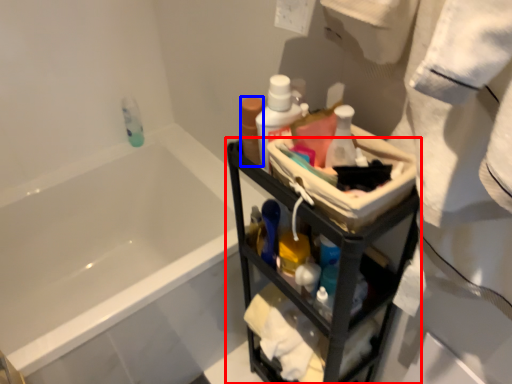
Question: Among these objects, which one is farthest to the camera, furniture (highlighted by a red box) or mouthwash (highlighted by a blue box)?

Choices:
 (A) furniture
 (B) mouthwash

Answer: (B)